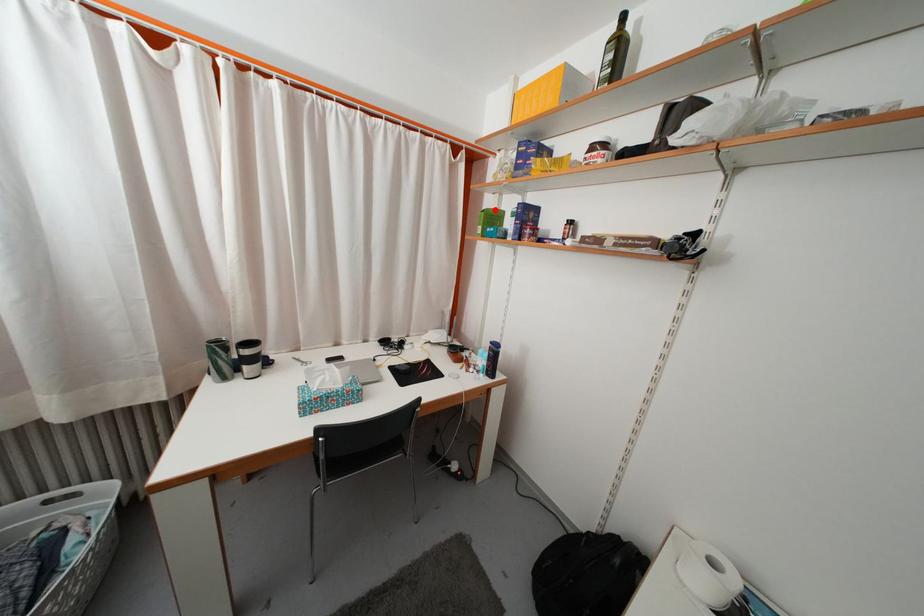
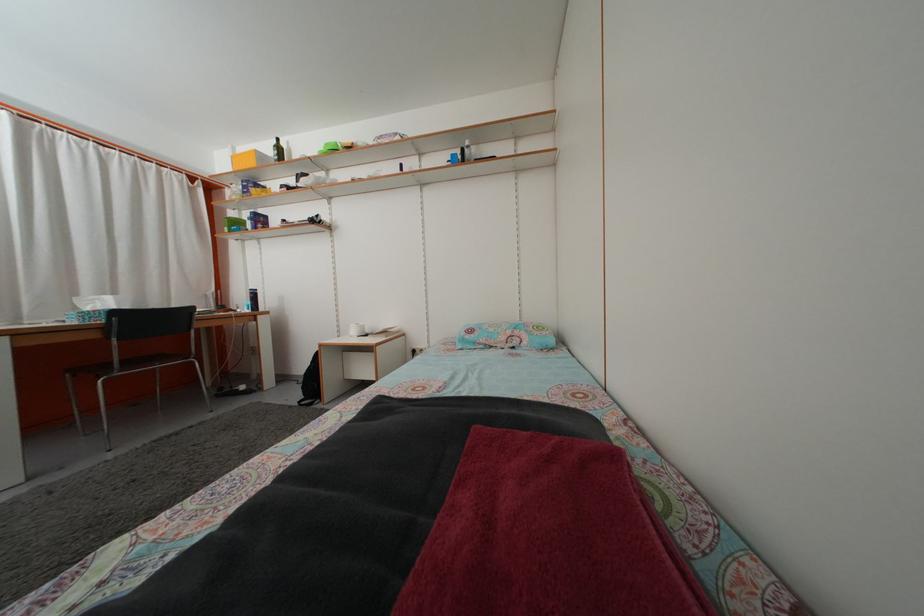
Locate, in the second image, the point that corresponds to the highlighted location in the first image.

(237, 223)